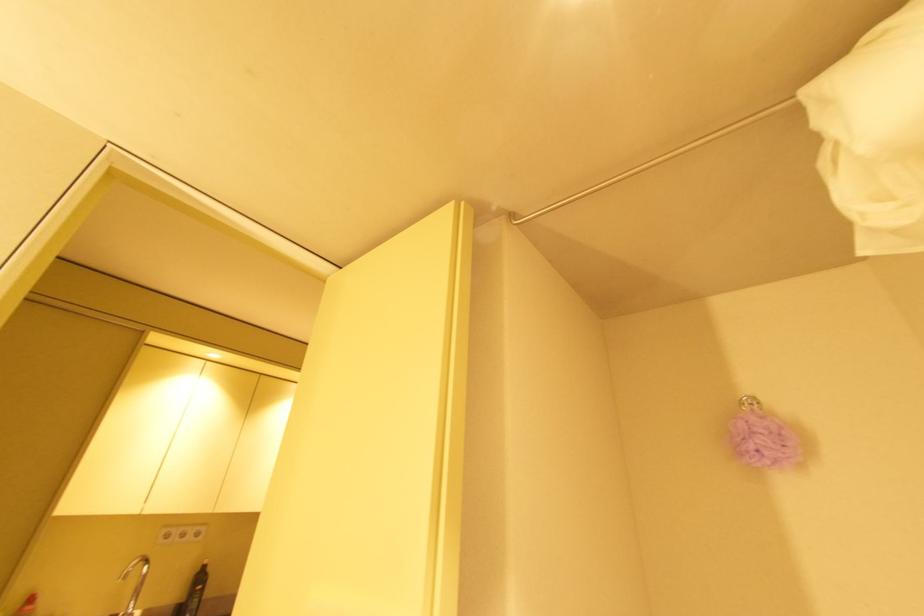
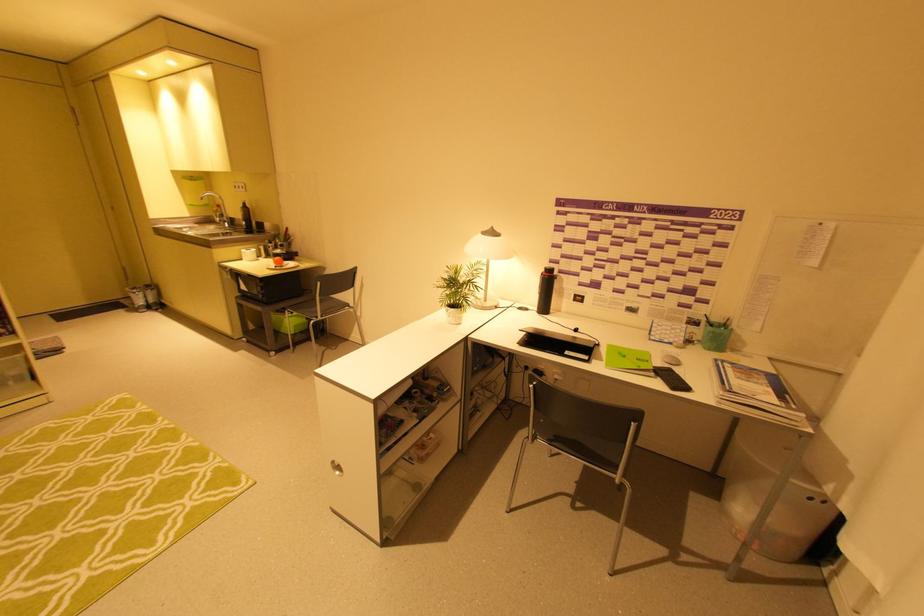
Where in the second image is the point corresponding to pixel 204 570 from the first image?

(246, 206)